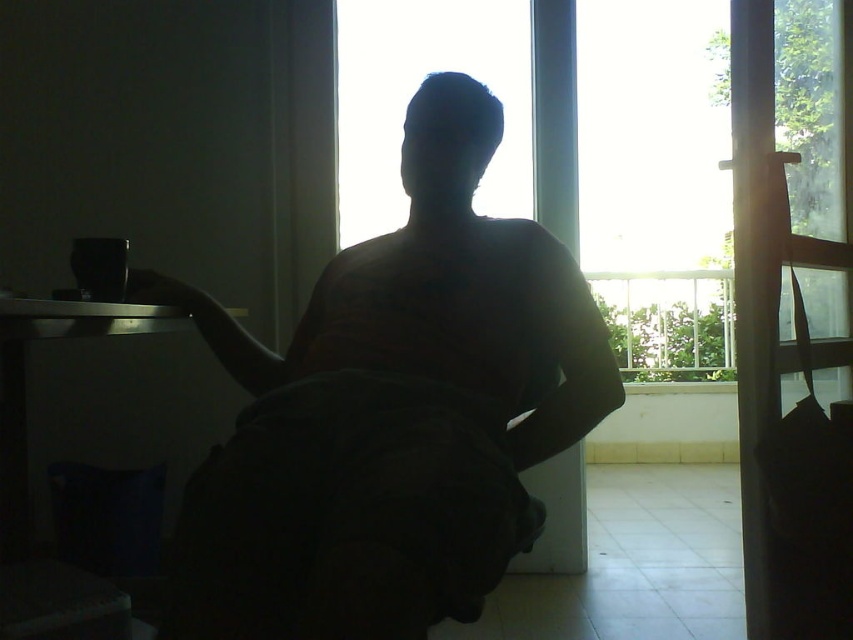
You are standing at the origin point of the room. The silhouette figure at center is located at point [390,412]. Can you determine the direction you need to move to reach the silhouette figure at center?

The silhouette figure at center is located at point [390,412], which means you need to move towards the right and forward to reach it from the origin point.

In the scene shown: You are a delivery robot trying to locate the entrance to the building. You see the silhouette figure at center and the transparent glass window at center in the image. Which object is closer to the entrance?

The silhouette figure at center is closer to the entrance than the transparent glass window at center because the figure is smaller, indicating it is farther away from the viewer, while the window is larger and closer.

You are a delivery robot that needs to deliver a package to the person sitting at the silhouette figure at center. The robot has a maximum delivery range of 25 inches. Can the robot reach the person?

The silhouette figure at center is 27.58 inches away from the camera, which exceeds the robot s maximum delivery range of 25 inches. Therefore, the robot cannot reach the person.